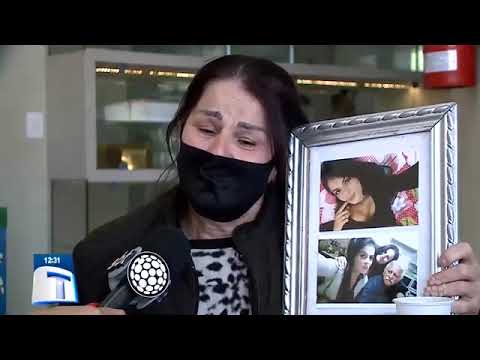
The width and height of the screenshot is (480, 360). In order to click on fire extinguisher in this screenshot , I will do `click(444, 66)`.